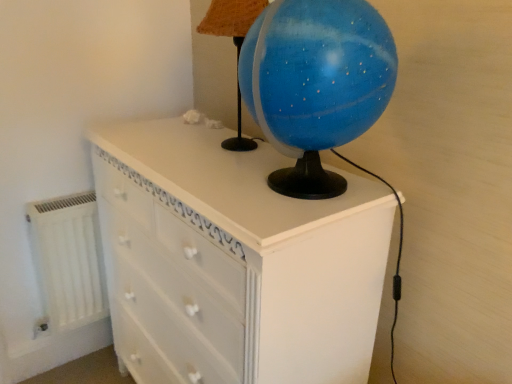
Question: From the image's perspective, does blue glossy globe at upper center appear lower than white matte radiator at lower left?

Choices:
 (A) no
 (B) yes

Answer: (A)

Question: From the image's perspective, is blue glossy globe at upper center on white matte radiator at lower left?

Choices:
 (A) no
 (B) yes

Answer: (B)

Question: Is the surface of blue glossy globe at upper center in direct contact with white matte radiator at lower left?

Choices:
 (A) yes
 (B) no

Answer: (B)

Question: Considering the relative positions of blue glossy globe at upper center and white matte radiator at lower left in the image provided, is blue glossy globe at upper center to the left of white matte radiator at lower left from the viewer's perspective?

Choices:
 (A) no
 (B) yes

Answer: (A)

Question: Can you confirm if blue glossy globe at upper center is positioned to the right of white matte radiator at lower left?

Choices:
 (A) no
 (B) yes

Answer: (B)

Question: From a real-world perspective, is blue glossy globe at upper center below white matte radiator at lower left?

Choices:
 (A) no
 (B) yes

Answer: (A)

Question: From a real-world perspective, is white matte radiator at lower left positioned over white painted wood chest of drawers at center based on gravity?

Choices:
 (A) no
 (B) yes

Answer: (A)

Question: Is white matte radiator at lower left far from white painted wood chest of drawers at center?

Choices:
 (A) no
 (B) yes

Answer: (A)

Question: Could you tell me if white matte radiator at lower left is facing white painted wood chest of drawers at center?

Choices:
 (A) no
 (B) yes

Answer: (A)

Question: Is white painted wood chest of drawers at center at the back of white matte radiator at lower left?

Choices:
 (A) no
 (B) yes

Answer: (A)

Question: Is the depth of white matte radiator at lower left greater than that of white painted wood chest of drawers at center?

Choices:
 (A) yes
 (B) no

Answer: (A)

Question: From a real-world perspective, is white matte radiator at lower left located beneath white painted wood chest of drawers at center?

Choices:
 (A) yes
 (B) no

Answer: (A)

Question: Considering the relative sizes of white painted wood chest of drawers at center and blue glossy globe at upper center in the image provided, is white painted wood chest of drawers at center shorter than blue glossy globe at upper center?

Choices:
 (A) no
 (B) yes

Answer: (A)